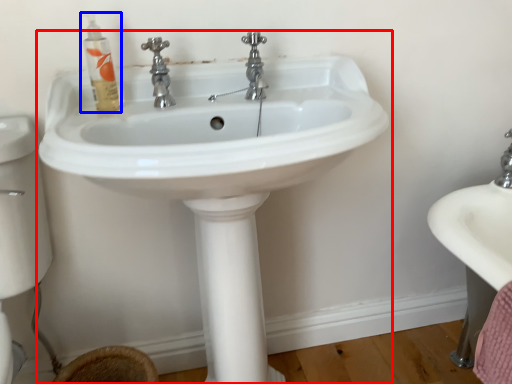
Question: Among these objects, which one is farthest to the camera, sink (highlighted by a red box) or mouthwash (highlighted by a blue box)?

Choices:
 (A) sink
 (B) mouthwash

Answer: (B)